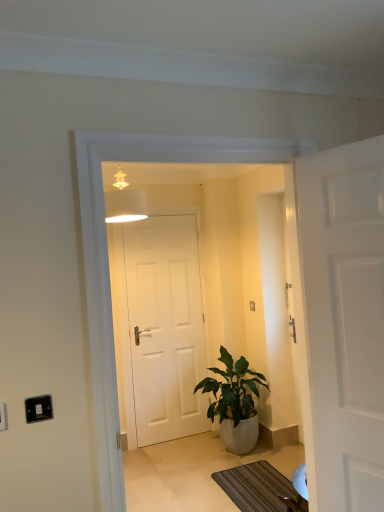
Find the location of a particular element. The image size is (384, 512). vacant area that lies in front of white matte door at center, the second door viewed from the front is located at coordinates pos(172,457).